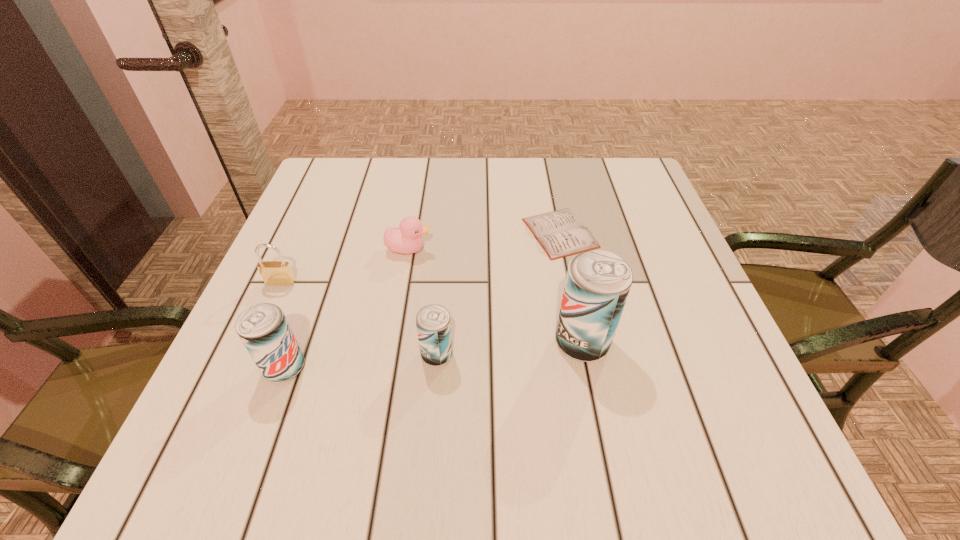
Locate an element on the screen. the fourth nearest object is located at coordinates (279, 273).

Where is `vacant space located 0.300m on the back of the leftmost beer can`? vacant space located 0.300m on the back of the leftmost beer can is located at coordinates (330, 242).

What are the coordinates of `free space located on the back of the shortest beer can` in the screenshot? It's located at (441, 305).

The height and width of the screenshot is (540, 960). Find the location of `free space located 0.070m on the left of the tallest object`. free space located 0.070m on the left of the tallest object is located at coordinates (516, 342).

Locate an element on the screen. free point located on the front-facing side of the fourth object from right to left is located at coordinates (464, 249).

You are a GUI agent. You are given a task and a screenshot of the screen. Output one action in this format:
    pyautogui.click(x=<x>, y=<y>)
    Task: Click on the blank area located 0.140m on the back of the shortest object
    The image size is (960, 540).
    Given the screenshot: What is the action you would take?
    pyautogui.click(x=549, y=178)

This screenshot has height=540, width=960. What are the coordinates of `vacant area located 0.190m on the front-facing side of the padlock` in the screenshot? It's located at (245, 363).

Find the location of `object at the far edge`. object at the far edge is located at coordinates (561, 233).

This screenshot has height=540, width=960. In order to click on object at the near edge in this screenshot , I will do `click(263, 328)`.

This screenshot has height=540, width=960. I want to click on beer can located in the left edge section of the desktop, so click(x=263, y=328).